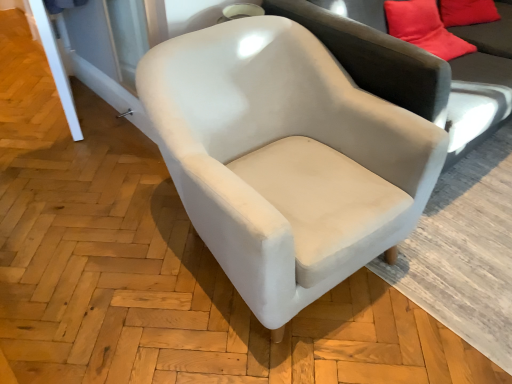
Question: Should I look upward or downward to see white velvet chair at center?

Choices:
 (A) up
 (B) down

Answer: (A)

Question: Does suede-like beige couch at center have a greater width compared to white velvet chair at center?

Choices:
 (A) yes
 (B) no

Answer: (A)

Question: Is suede-like beige couch at center next to white velvet chair at center and touching it?

Choices:
 (A) yes
 (B) no

Answer: (B)

Question: Considering the relative sizes of suede-like beige couch at center and white velvet chair at center in the image provided, is suede-like beige couch at center thinner than white velvet chair at center?

Choices:
 (A) no
 (B) yes

Answer: (A)

Question: Considering the relative sizes of suede-like beige couch at center and white velvet chair at center in the image provided, is suede-like beige couch at center smaller than white velvet chair at center?

Choices:
 (A) yes
 (B) no

Answer: (B)

Question: From the image's perspective, does suede-like beige couch at center appear higher than white velvet chair at center?

Choices:
 (A) no
 (B) yes

Answer: (B)

Question: Is white velvet chair at center located within suede-like beige couch at center?

Choices:
 (A) no
 (B) yes

Answer: (A)

Question: Is white velvet chair at center far from suede-like beige couch at center?

Choices:
 (A) yes
 (B) no

Answer: (B)

Question: Does white velvet chair at center have a greater height compared to suede-like beige couch at center?

Choices:
 (A) yes
 (B) no

Answer: (B)

Question: Considering the relative positions of white velvet chair at center and suede-like beige couch at center in the image provided, is white velvet chair at center to the left of suede-like beige couch at center from the viewer's perspective?

Choices:
 (A) yes
 (B) no

Answer: (A)

Question: Is white velvet chair at center located outside suede-like beige couch at center?

Choices:
 (A) no
 (B) yes

Answer: (B)

Question: From a real-world perspective, is white velvet chair at center positioned over suede-like beige couch at center based on gravity?

Choices:
 (A) yes
 (B) no

Answer: (B)

Question: Is white velvet chair at center thinner than suede-like beige couch at center?

Choices:
 (A) yes
 (B) no

Answer: (A)

Question: Is suede-like beige couch at center inside or outside of white velvet chair at center?

Choices:
 (A) outside
 (B) inside

Answer: (A)